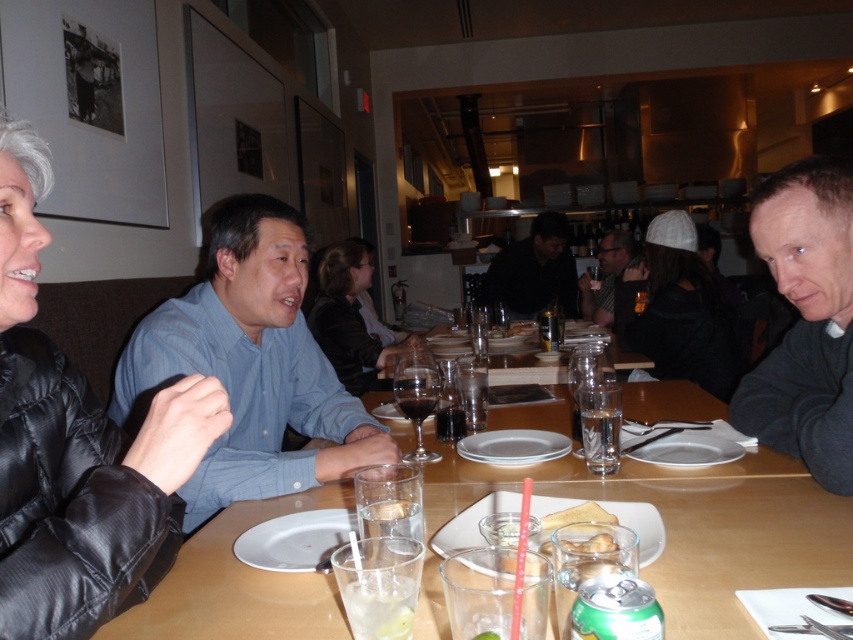
You are a delivery person who needs to place a package between the black puffer jacket at left and the dark blue shirt at center. The package measures 1 foot in length. Can you fit it between them without moving either item?

The distance between the black puffer jacket at left and the dark blue shirt at center is 13.57 feet. Since the package is only 1 foot long, there is ample space to place it between them without moving either item.

You are a waiter in a restaurant and need to deliver a dessert to the customer sitting at the table. The customer is wearing either the dark blue shirt at center or the matte black jacket at center. Which one should you approach?

You should approach the matte black jacket at center because the dark blue shirt at center is positioned over it, meaning the matte black jacket at center is the visible one on top.

Consider the image. You are a server in a restaurant and need to place a new drink order for the customer seated at the table. The customer wants a large soda. The soda can you have is the green can of soda mentioned in the scene. However, there is an object at the table center that might block the space. Can you place the green can of soda on the table without moving any existing items, considering the size of the matte black jacket at center and the clear glass water at table center?

Answer: The matte black jacket at center is larger in size than the clear glass water at table center. Since the jacket is bigger, it might occupy more space at the center, but the clear glass water at table center is smaller. However, the exact placement and available space aren